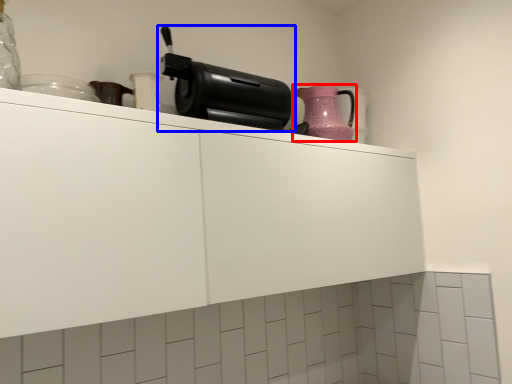
Question: Which point is closer to the camera, kitchen appliance (highlighted by a red box) or home appliance (highlighted by a blue box)?

Choices:
 (A) kitchen appliance
 (B) home appliance

Answer: (B)